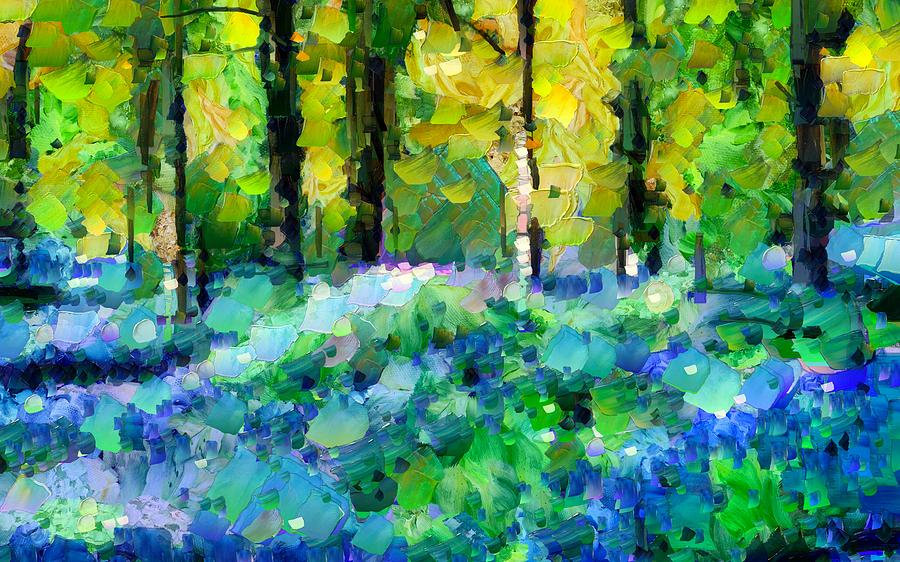
The width and height of the screenshot is (900, 562). I want to click on painting, so click(578, 166).